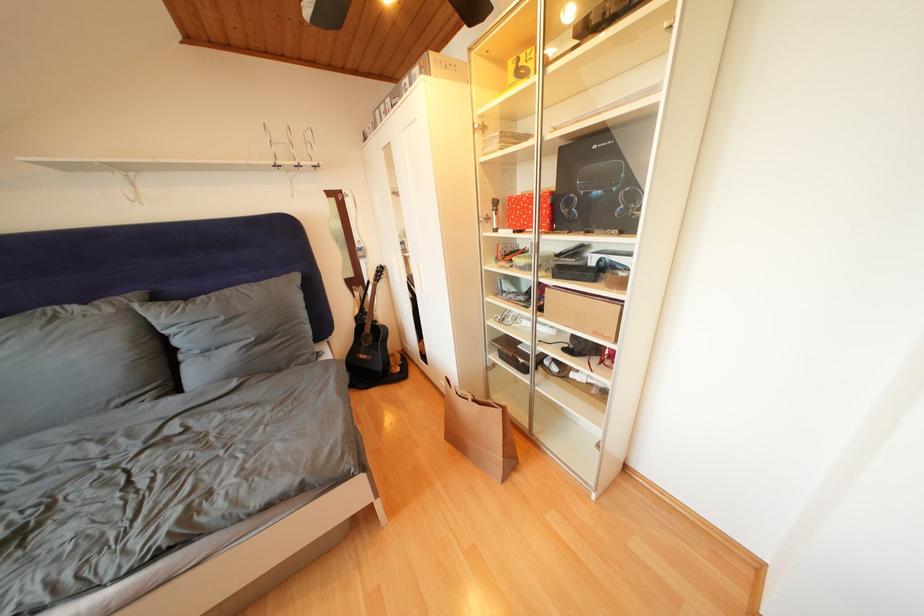
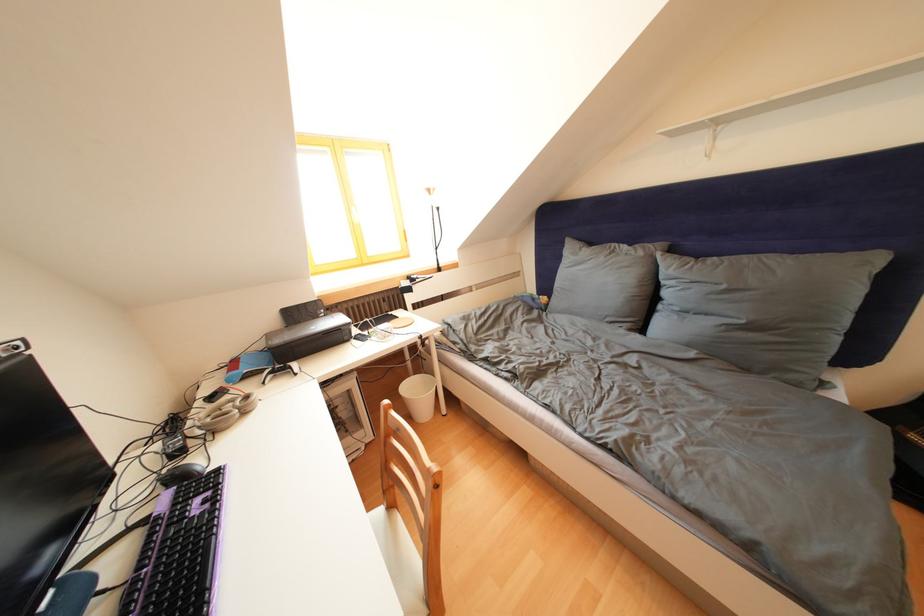
Find the pixel in the second image that matches pixel 117 315 in the first image.

(649, 259)